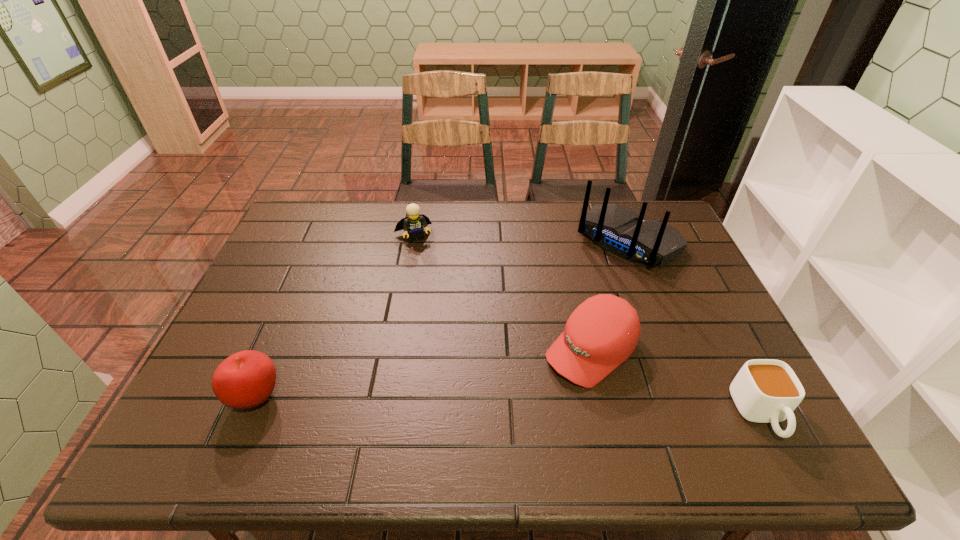
The height and width of the screenshot is (540, 960). I want to click on the leftmost object, so click(x=246, y=379).

Identify the location of cup. pos(765,390).

The image size is (960, 540). In order to click on cap in this screenshot , I will do [x=602, y=332].

In order to click on the fourth object from right to left in this screenshot , I will do `click(414, 223)`.

Find the location of a particular element. the tallest object is located at coordinates (616, 229).

Where is `vacant area situated on the back of the apple`? This screenshot has height=540, width=960. vacant area situated on the back of the apple is located at coordinates (274, 355).

Identify the location of free location located 0.110m on the front-facing side of the cap. point(529,403).

Find the location of `free space located 0.090m on the front-facing side of the cap`. free space located 0.090m on the front-facing side of the cap is located at coordinates (535, 397).

Locate an element on the screen. vacant space located on the front-facing side of the cap is located at coordinates (522, 408).

Locate an element on the screen. vacant space located 0.290m on the front-facing side of the Lego is located at coordinates (444, 307).